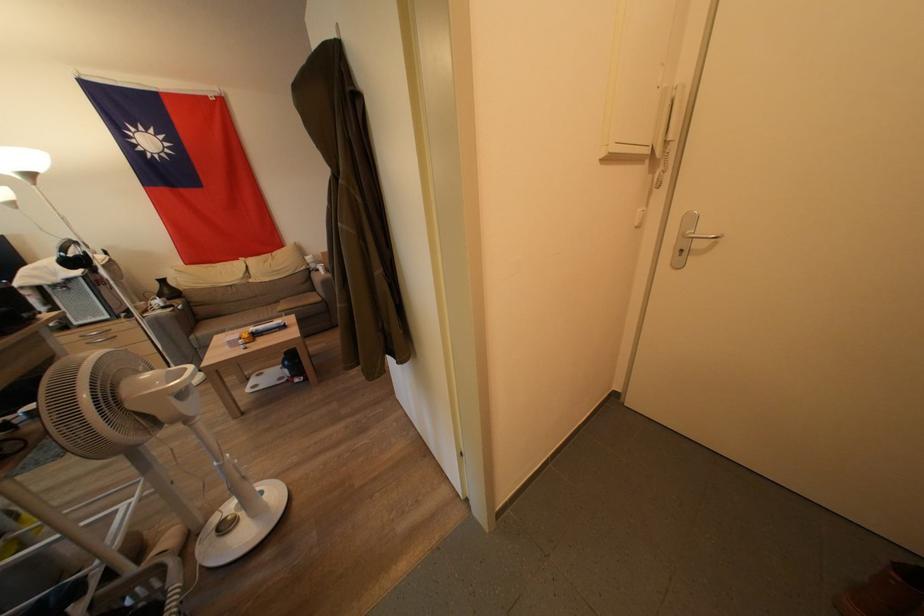
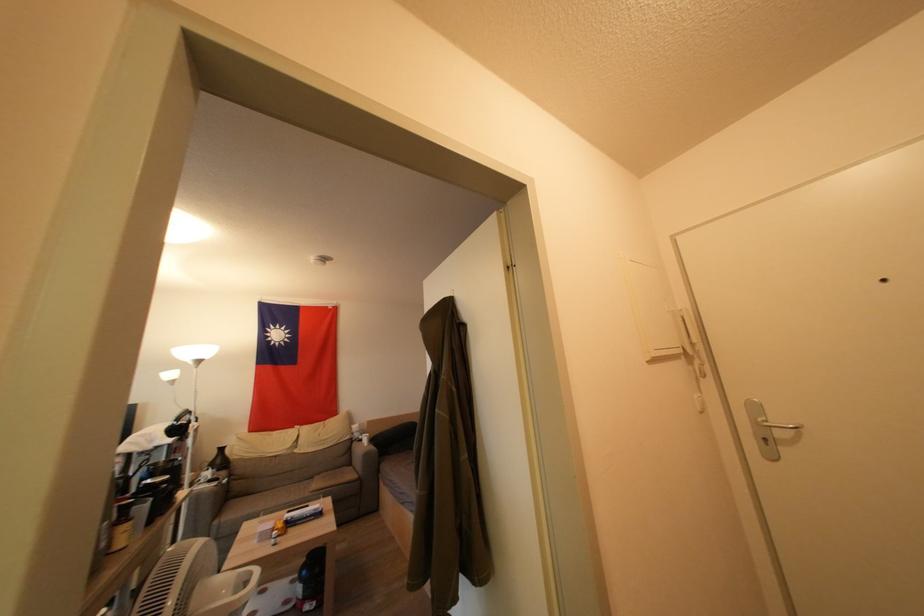
Where in the second image is the point corresponding to [172,296] from the first image?

(224, 464)